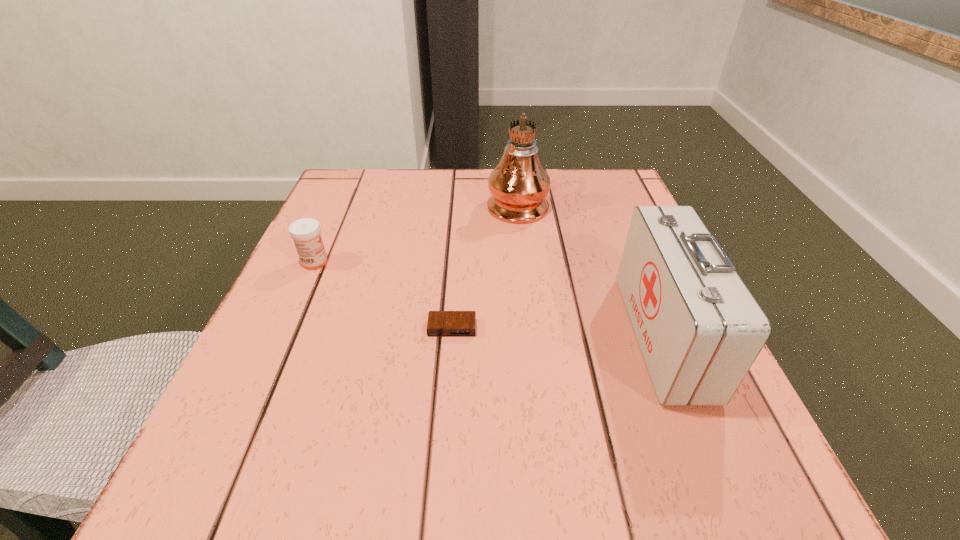
Where is `vacant space in between the second shortest object and the shortest object`? Image resolution: width=960 pixels, height=540 pixels. vacant space in between the second shortest object and the shortest object is located at coordinates (383, 295).

Locate an element on the screen. This screenshot has height=540, width=960. empty space that is in between the third shortest object and the third nearest object is located at coordinates (489, 299).

In order to click on free space between the second tallest object and the alarm clock in this screenshot , I will do `click(558, 332)`.

Identify which object is located as the nearest to the tallest object. Please provide its 2D coordinates. Your answer should be formatted as a tuple, i.e. [(x, y)], where the tuple contains the x and y coordinates of a point satisfying the conditions above.

[(699, 328)]

Locate an element on the screen. The image size is (960, 540). object that is the third closest one to the second shortest object is located at coordinates (699, 328).